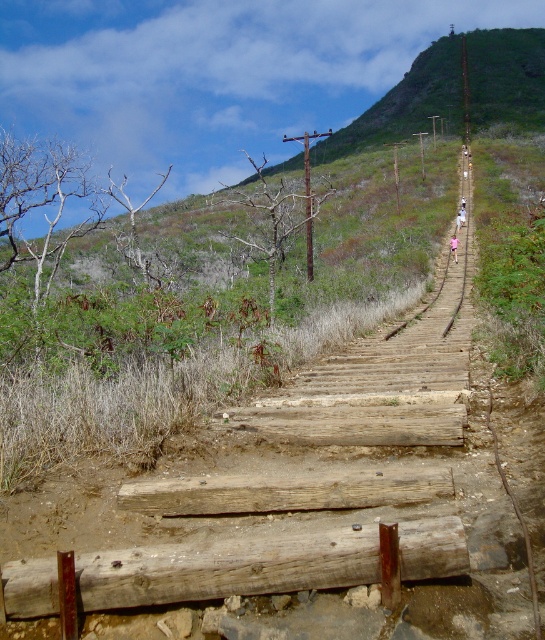
In the scene shown: You are a hiker trying to locate the wooden staircase on the hillside. According to the coordinates provided, where should you look to find the weathered wood at center?

The weathered wood at center is located at coordinates point (228, 566).

You are a hiker carrying a heavy backpack and need to step on the weathered wood at center and the weathered brown log at center. Which one is wider to step on?

The weathered wood at center is wider than the weathered brown log at center, so it is the wider one to step on.